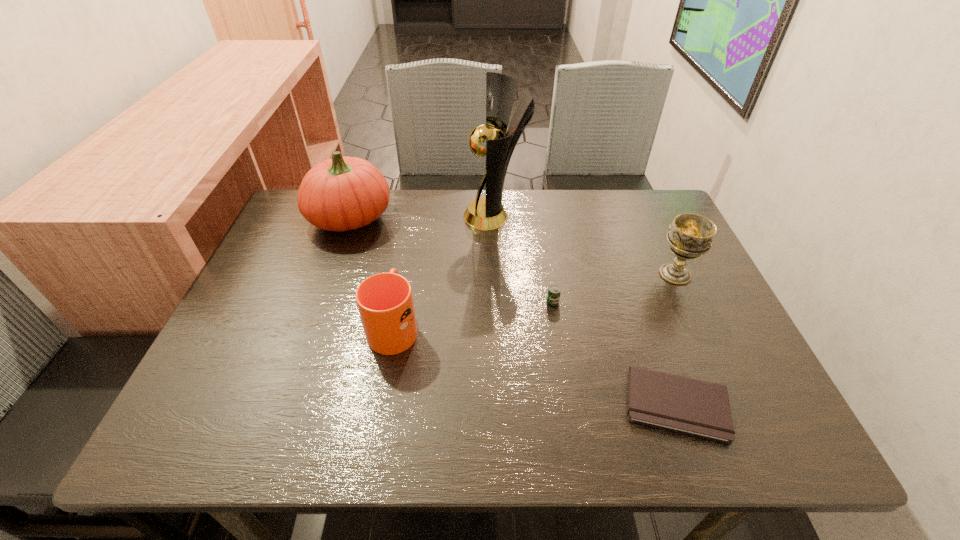
You are a GUI agent. You are given a task and a screenshot of the screen. Output one action in this format:
    pyautogui.click(x=<x>, y=<y>)
    Task: Click on the object present at the near edge
    This screenshot has height=540, width=960.
    Given the screenshot: What is the action you would take?
    pyautogui.click(x=698, y=408)

I want to click on object that is at the left edge, so click(x=345, y=193).

At what (x,y) coordinates should I click in order to perform the action: click on chalice at the right edge. Please return your answer as a coordinate pair (x, y). Looking at the image, I should click on (690, 235).

I want to click on checkbook located at the right edge, so click(x=698, y=408).

This screenshot has height=540, width=960. Find the location of `object that is positioned at the far left corner`. object that is positioned at the far left corner is located at coordinates (345, 193).

You are a GUI agent. You are given a task and a screenshot of the screen. Output one action in this format:
    pyautogui.click(x=<x>, y=<y>)
    Task: Click on the object present at the near right corner
    The image size is (960, 540).
    Given the screenshot: What is the action you would take?
    pyautogui.click(x=698, y=408)

Find the location of a particular element. The height and width of the screenshot is (540, 960). free space at the far edge of the desktop is located at coordinates (530, 195).

Where is `vacant space at the near edge of the desktop`? The image size is (960, 540). vacant space at the near edge of the desktop is located at coordinates [x=483, y=423].

You are a GUI agent. You are given a task and a screenshot of the screen. Output one action in this format:
    pyautogui.click(x=<x>, y=<y>)
    Task: Click on the vacant region at the left edge of the desktop
    The width and height of the screenshot is (960, 540).
    Given the screenshot: What is the action you would take?
    pyautogui.click(x=271, y=377)

Where is `vacant area at the right edge of the desktop`? The height and width of the screenshot is (540, 960). vacant area at the right edge of the desktop is located at coordinates click(650, 247).